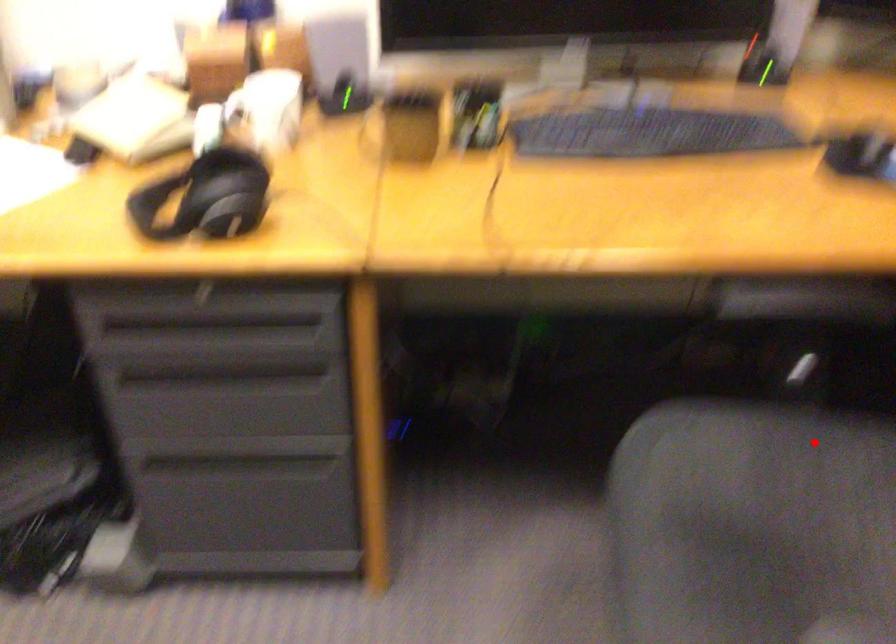
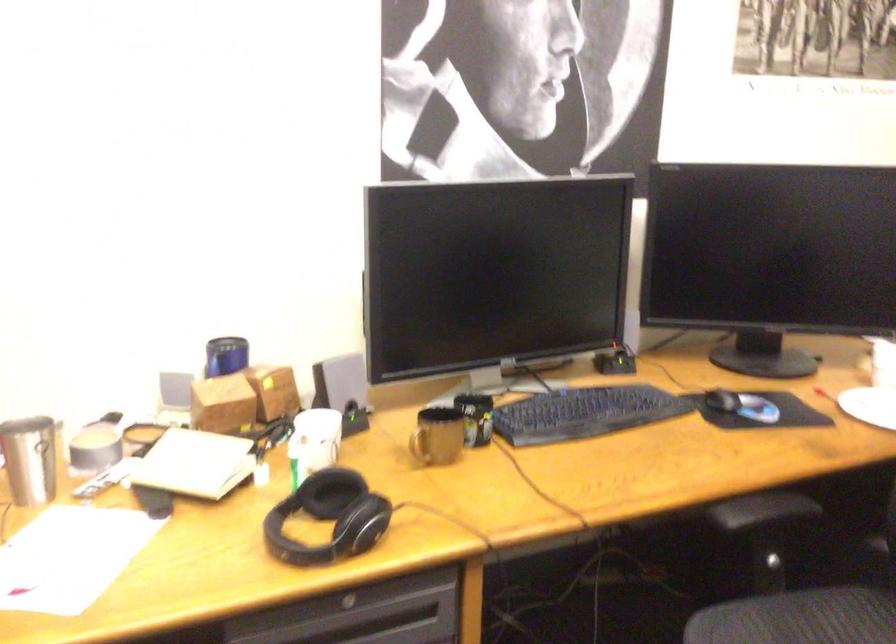
Question: I am providing you with two images of the same scene from different viewpoints. A red point is marked on the first image. Is the red point's position out of view in image 2?

Choices:
 (A) Yes
 (B) No

Answer: (B)